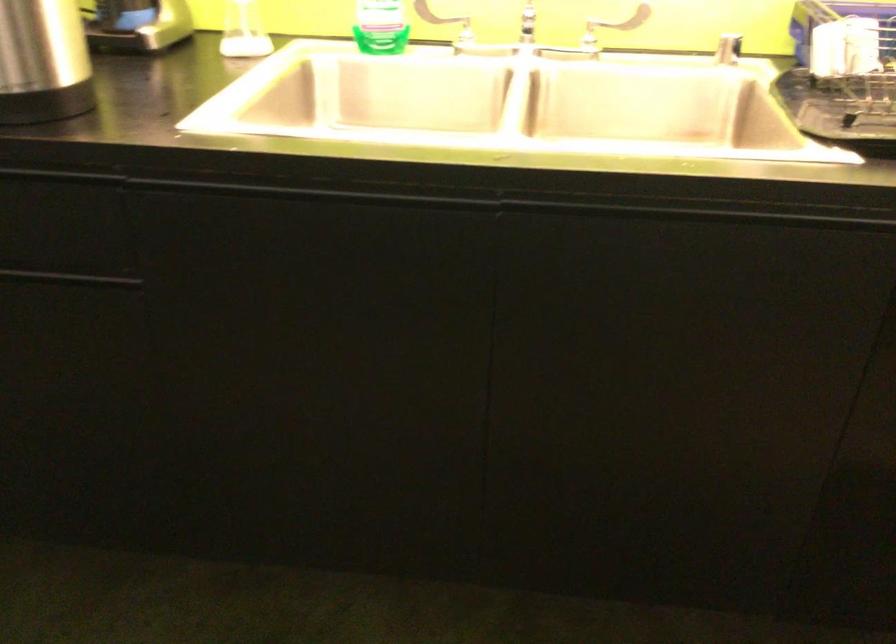
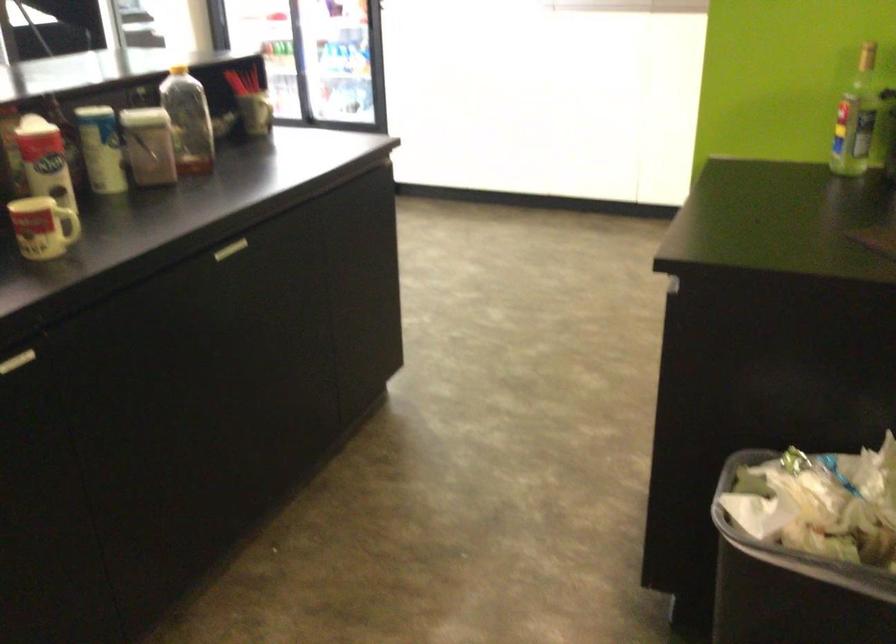
The first image is from the beginning of the video and the second image is from the end. How did the camera likely rotate when shooting the video?

The camera rotated toward left-down.